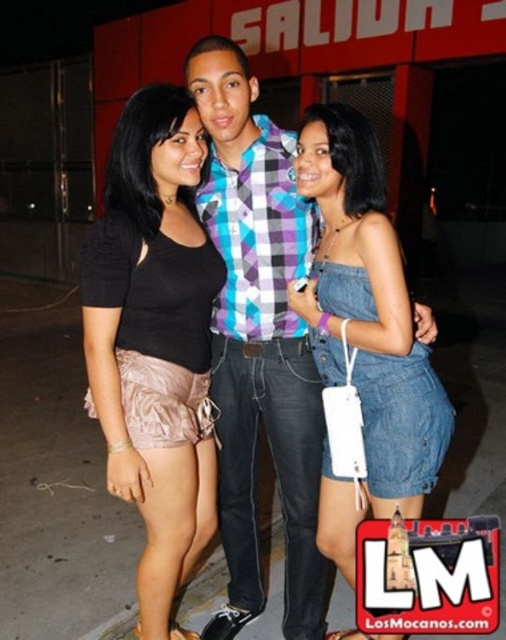
Is matte black top at center thinner than plaid shirt at center?

Indeed, matte black top at center has a lesser width compared to plaid shirt at center.

Find the location of a particular element. The height and width of the screenshot is (640, 506). matte black top at center is located at coordinates (154, 340).

Locate an element on the screen. matte black top at center is located at coordinates (154, 340).

Image resolution: width=506 pixels, height=640 pixels. In order to click on matte black top at center in this screenshot , I will do `click(154, 340)`.

Is plaid shirt at center thinner than denim dress at center?

No.

Which is more to the left, plaid shirt at center or denim dress at center?

From the viewer's perspective, plaid shirt at center appears more on the left side.

At what (x,y) coordinates should I click in order to perform the action: click on plaid shirt at center. Please return your answer as a coordinate pair (x, y). The image size is (506, 640). Looking at the image, I should click on (260, 342).

Is matte black top at center above denim dress at center?

Indeed, matte black top at center is positioned over denim dress at center.

Is point (155, 180) positioned behind point (392, 445)?

Yes, it is behind point (392, 445).

Where is `matte black top at center`? The width and height of the screenshot is (506, 640). matte black top at center is located at coordinates (154, 340).